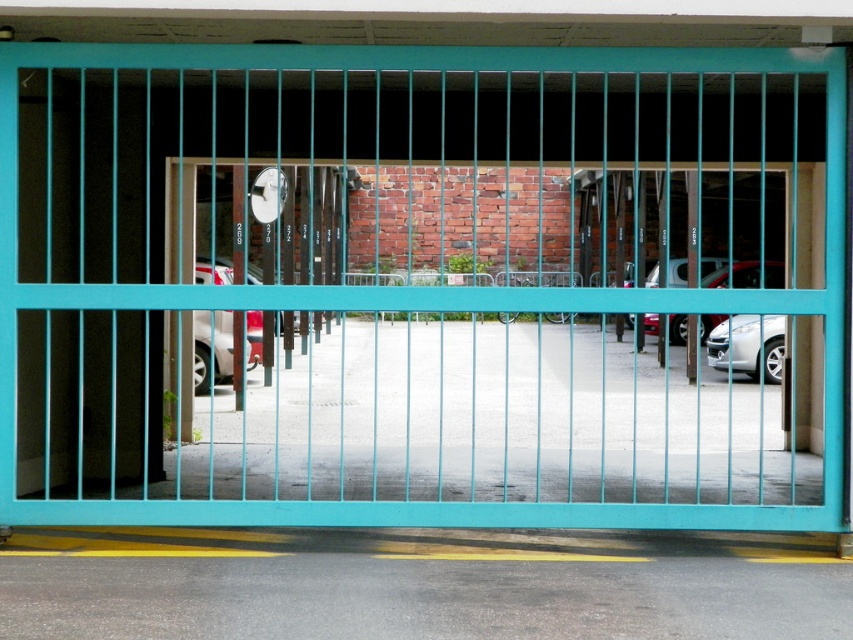
You are standing in front of the teal metal gate looking into the parking area. There is a point marked at coordinates (212, 349). What object does this point correspond to?

The point at coordinates (212, 349) corresponds to the white glossy car at center.

You are a delivery driver who needs to park your van behind the white glossy car at center and the satin silver car at center. Can you park your van behind both cars without moving them?

The white glossy car at center is in front of the satin silver car at center, so you can park your van behind the satin silver car at center, but not behind the white glossy car at center since it is blocking the view.